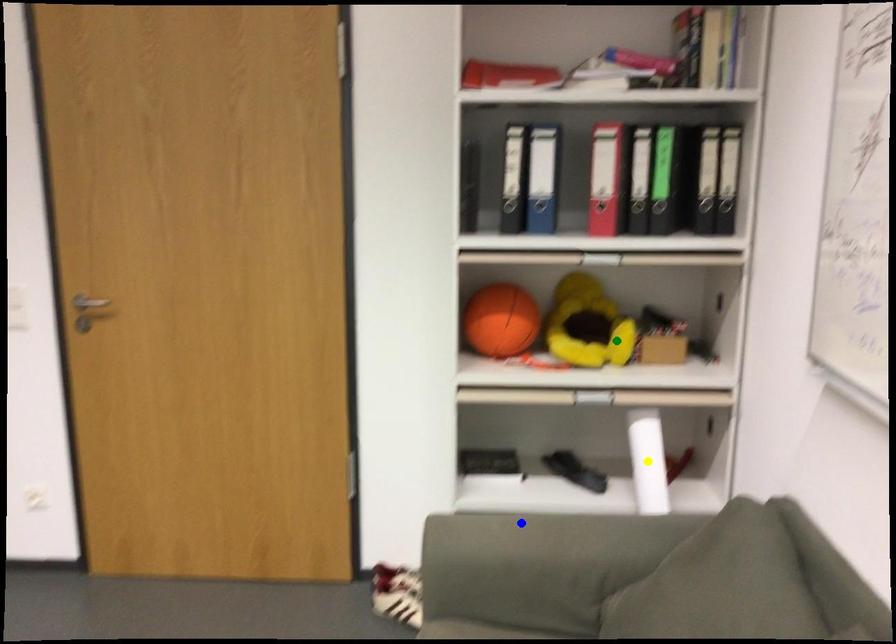
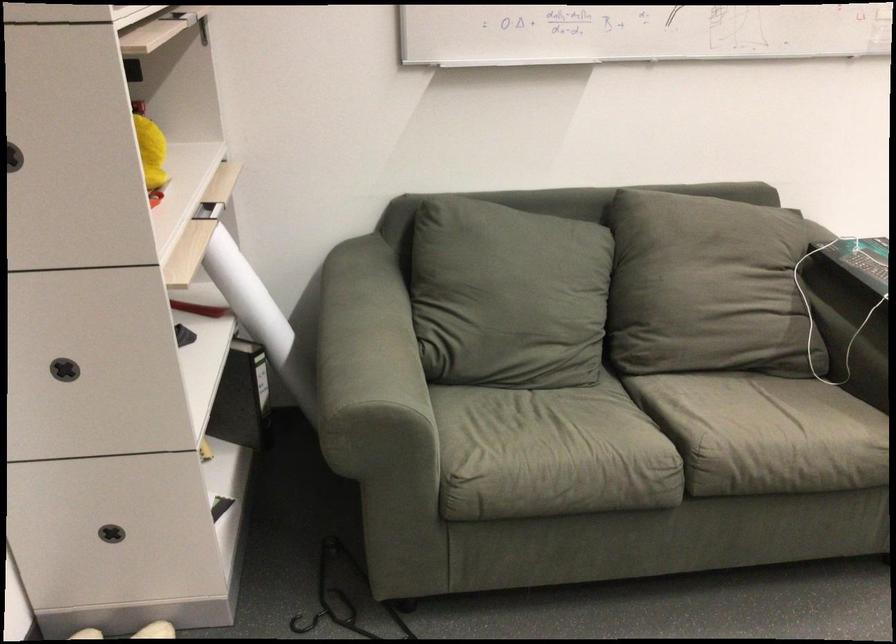
I am providing you with two images of the same scene from different viewpoints. Three points are marked in image1. Which point corresponds to a part or object that is occluded in image2?In image1, three points are marked. Which of them correspond to a part or object that is occluded in image2?Among the three points shown in image1, which one corresponds to a part or object that is no longer visible due to occlusion in image2?

yellow point cannot be seen in image2.